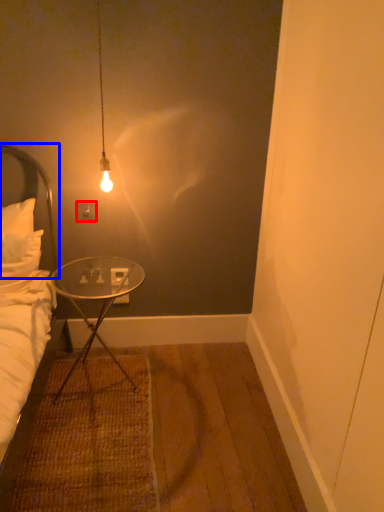
Question: Which of the following is the closest to the observer, power outlet (highlighted by a red box) or headboard (highlighted by a blue box)?

Choices:
 (A) power outlet
 (B) headboard

Answer: (B)